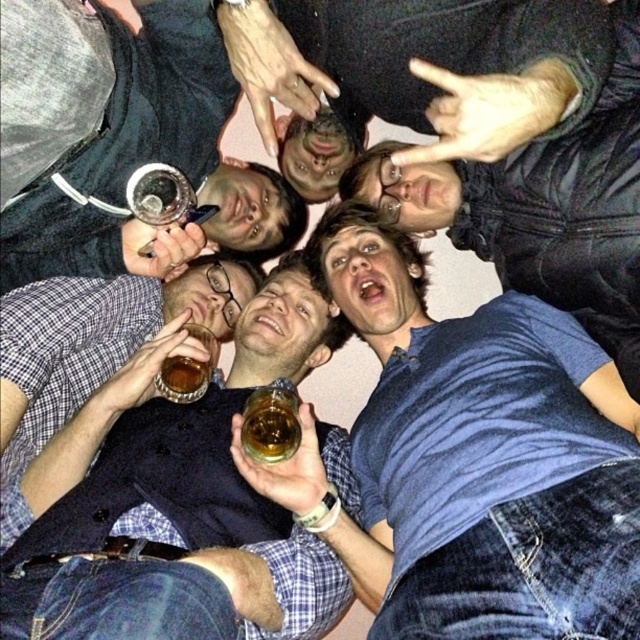
Is blue denim shirt at center to the right of translucent glass cup at center from the viewer's perspective?

Yes, blue denim shirt at center is to the right of translucent glass cup at center.

Is blue denim shirt at center bigger than translucent glass cup at center?

Correct, blue denim shirt at center is larger in size than translucent glass cup at center.

Who is more distant from viewer, (138, 556) or (161, 390)?

The point (161, 390) is more distant.

You are a GUI agent. You are given a task and a screenshot of the screen. Output one action in this format:
    pyautogui.click(x=<x>, y=<y>)
    Task: Click on the blue denim shirt at center
    The image size is (640, 640).
    Given the screenshot: What is the action you would take?
    pyautogui.click(x=170, y=502)

Looking at this image, who is taller, blue cotton shirt at center or blue denim shirt at center?

blue cotton shirt at center is taller.

Is blue cotton shirt at center bigger than blue denim shirt at center?

Yes.

The height and width of the screenshot is (640, 640). Describe the element at coordinates (481, 458) in the screenshot. I see `blue cotton shirt at center` at that location.

Locate an element on the screen. blue cotton shirt at center is located at coordinates [481, 458].

Who is more forward, (378,106) or (506,280)?

Point (506,280) is more forward.

Which is more to the right, dark blue shirt at center or blue striped shirt at center?

Positioned to the right is blue striped shirt at center.

Which is behind, point (550, 29) or point (637, 268)?

The point (637, 268) is behind.

What are the coordinates of `dark blue shirt at center` in the screenshot? It's located at (424, 67).